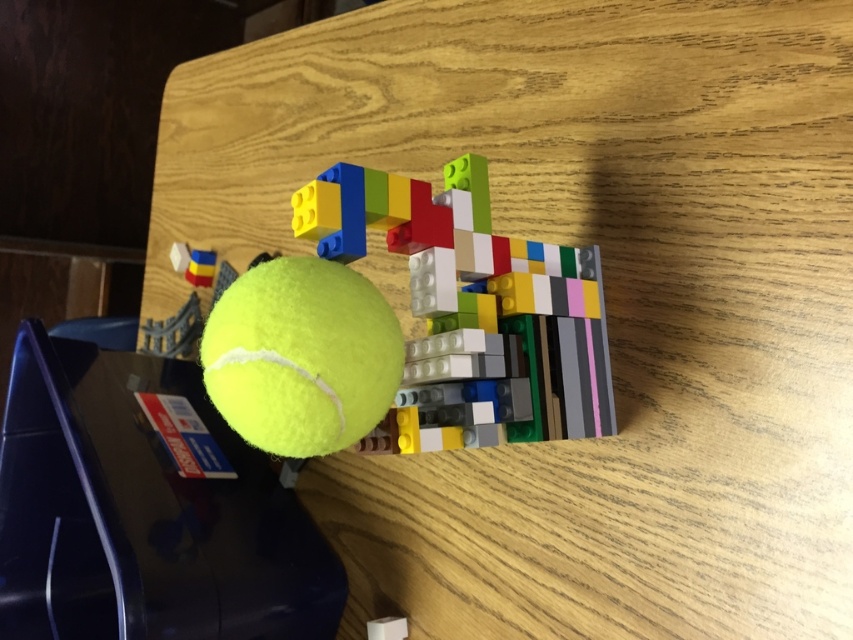
You are looking at the LEGO tennis racket and the yellow tennis ball on the table. You notice two points marked on the table surface. The first point is at coordinates point (611, 388) and the second point is at point (276, 364). From your perspective, which point is closer to the front edge of the table?

Point (276, 364) is closer to the front edge of the table because it is in front of point (611, 388).

You are a small robot with a 3.5 inch wide arm. You need to pick up the yellow matte tennis ball at center without touching the multicolored plastic blocks at center. Is there enough space between them for your arm to reach?

The distance between the multicolored plastic blocks at center and the yellow matte tennis ball at center is 5.38 inches. Since your arm is 3.5 inches wide, there is enough space for your arm to fit between them without touching either object.

You are a child trying to grab the yellow matte tennis ball at center from the table. The multicolored plastic blocks at center are in your way. Can you reach the ball without moving the blocks?

The yellow matte tennis ball at center is behind the multicolored plastic blocks at center, so you can reach it without moving the blocks because it is positioned behind them and accessible from that side.